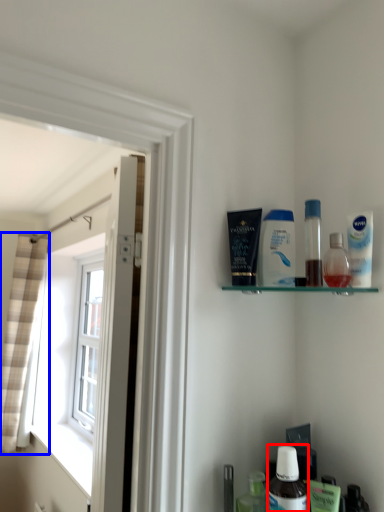
Question: Which object appears closest to the camera in this image, mouthwash (highlighted by a red box) or curtain (highlighted by a blue box)?

Choices:
 (A) mouthwash
 (B) curtain

Answer: (A)